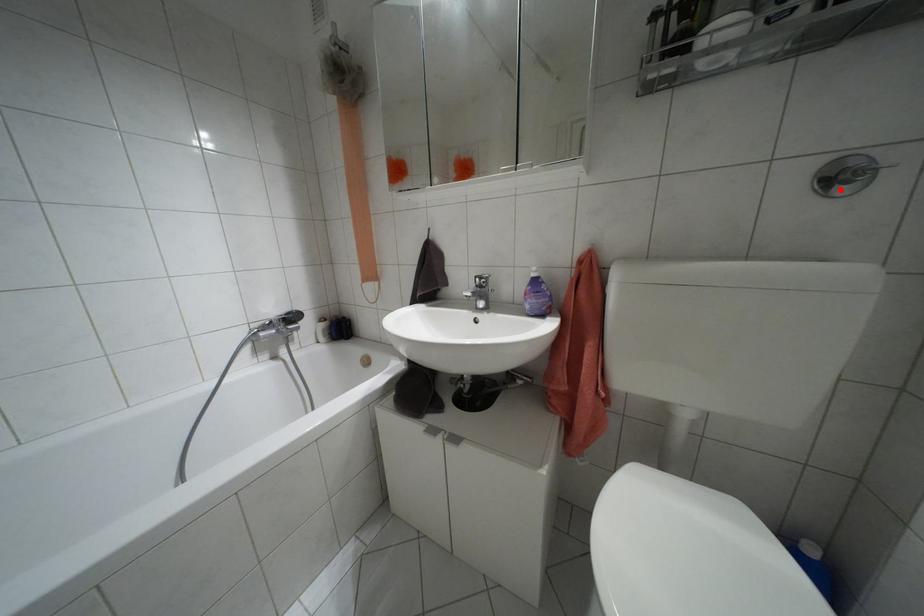
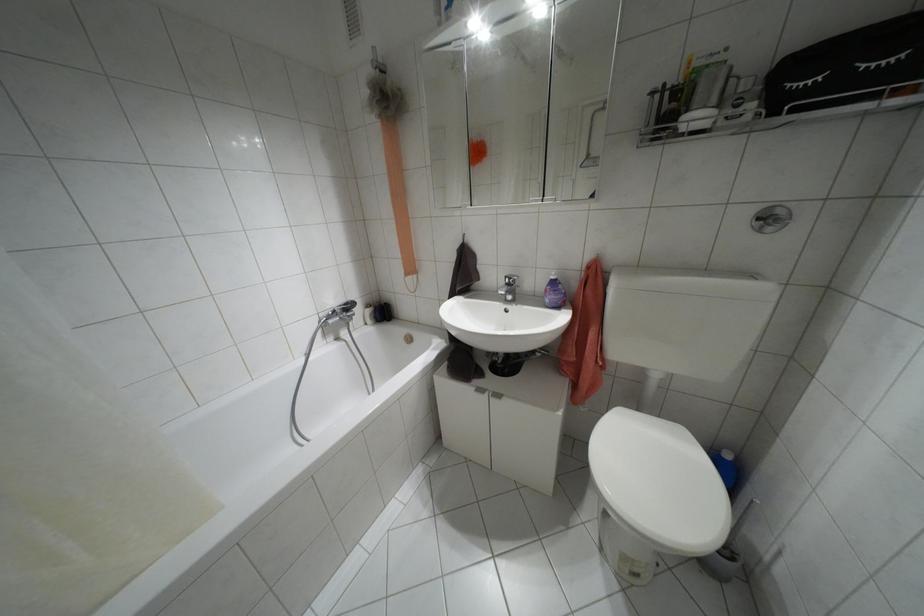
In the second image, find the point that corresponds to the highlighted location in the first image.

(769, 228)